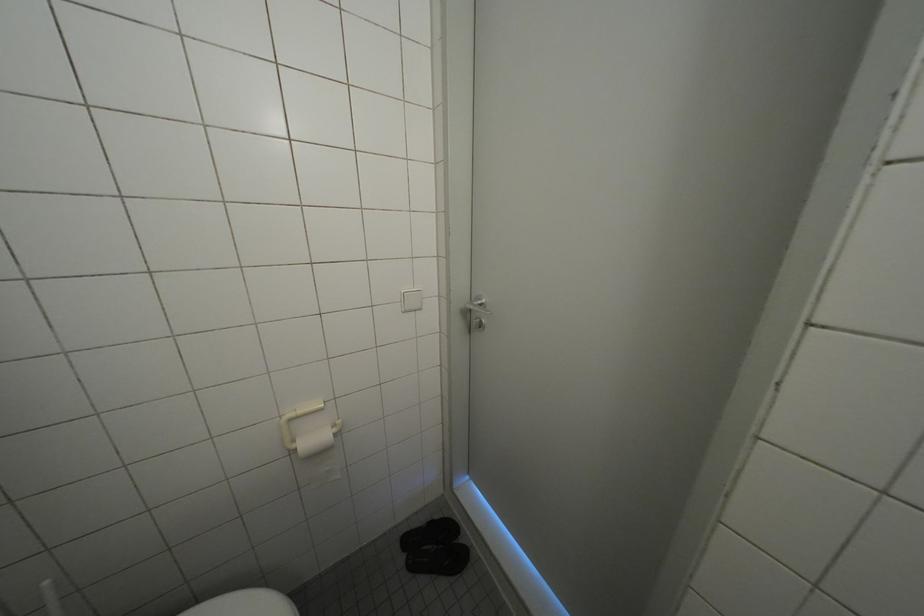
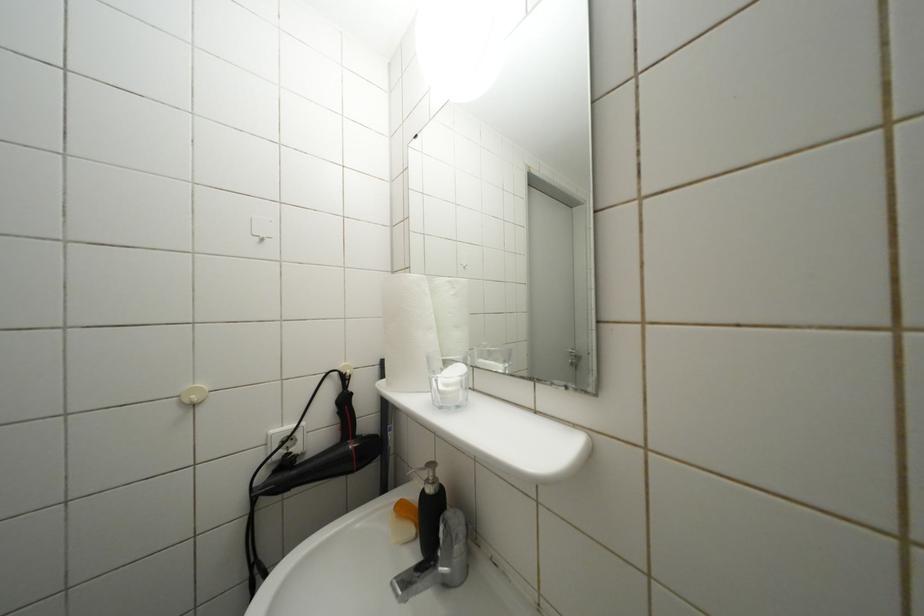
Question: The camera is either moving clockwise (left) or counter-clockwise (right) around the object. The first image is from the beginning of the video and the second image is from the end. Is the camera moving left or right when shooting the video?

Choices:
 (A) Left
 (B) Right

Answer: (A)